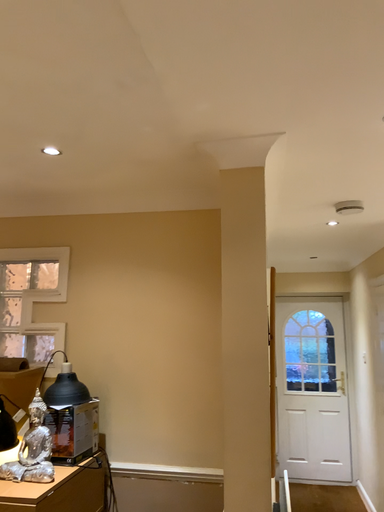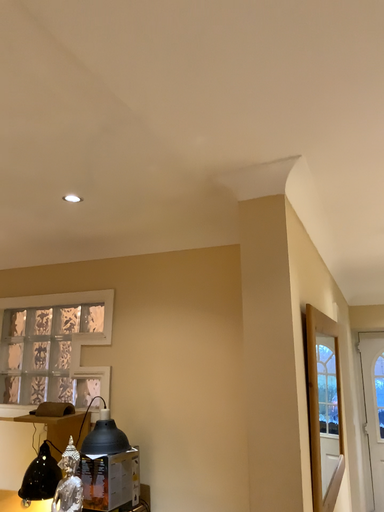
Question: How did the camera likely rotate when shooting the video?

Choices:
 (A) rotated right
 (B) rotated left

Answer: (B)